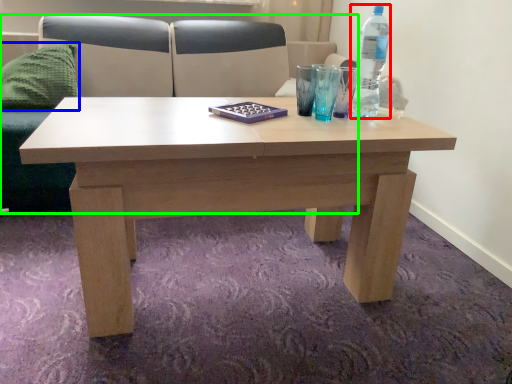
Question: Estimate the real-world distances between objects in this image. Which object is closer to bottle (highlighted by a red box), pillow (highlighted by a blue box) or couch (highlighted by a green box)?

Choices:
 (A) pillow
 (B) couch

Answer: (B)